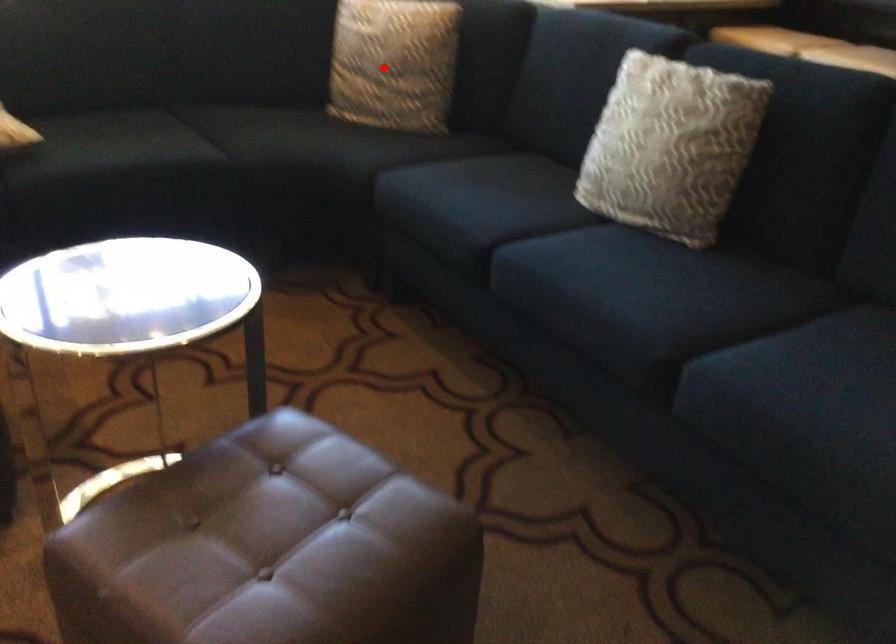
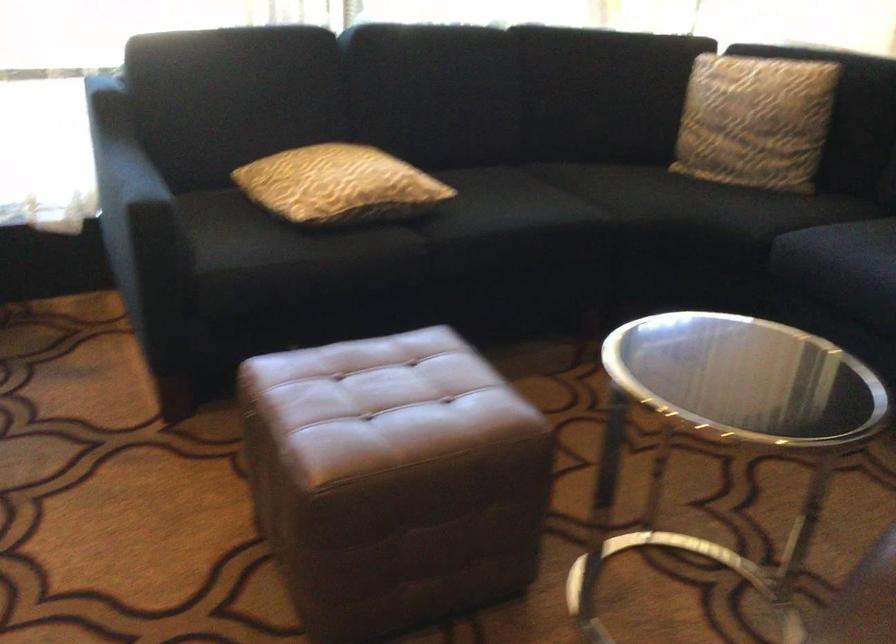
Find the pixel in the second image that matches the highlighted location in the first image.

(754, 120)